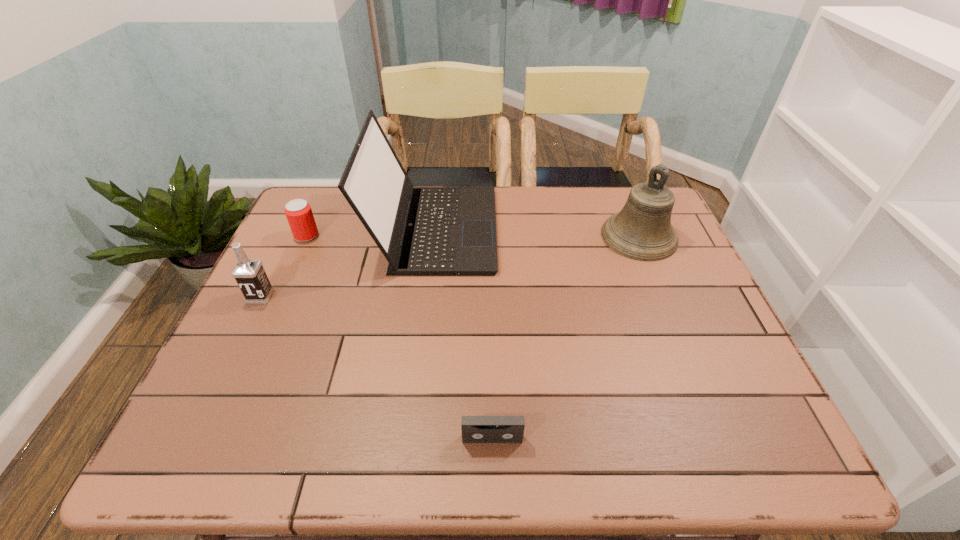
Find the location of `vacant space located 0.390m on the front label of the vodka`. vacant space located 0.390m on the front label of the vodka is located at coordinates (180, 461).

Locate an element on the screen. Image resolution: width=960 pixels, height=540 pixels. free space located on the front of the beer can is located at coordinates (283, 288).

You are a GUI agent. You are given a task and a screenshot of the screen. Output one action in this format:
    pyautogui.click(x=<x>, y=<y>)
    Task: Click on the laptop located at the far edge
    
    Given the screenshot: What is the action you would take?
    pyautogui.click(x=422, y=231)

Image resolution: width=960 pixels, height=540 pixels. Identify the location of bell that is at the far edge. (642, 230).

I want to click on beer can located at the far edge, so click(299, 214).

This screenshot has height=540, width=960. I want to click on object that is at the near edge, so click(475, 429).

Identify the location of vodka at the left edge. Image resolution: width=960 pixels, height=540 pixels. (249, 274).

Find the location of a particular element. This screenshot has width=960, height=540. beer can that is at the left edge is located at coordinates (299, 214).

What are the coordinates of `object present at the right edge` in the screenshot? It's located at (642, 230).

Find the location of a particular element. The height and width of the screenshot is (540, 960). object situated at the far left corner is located at coordinates (299, 214).